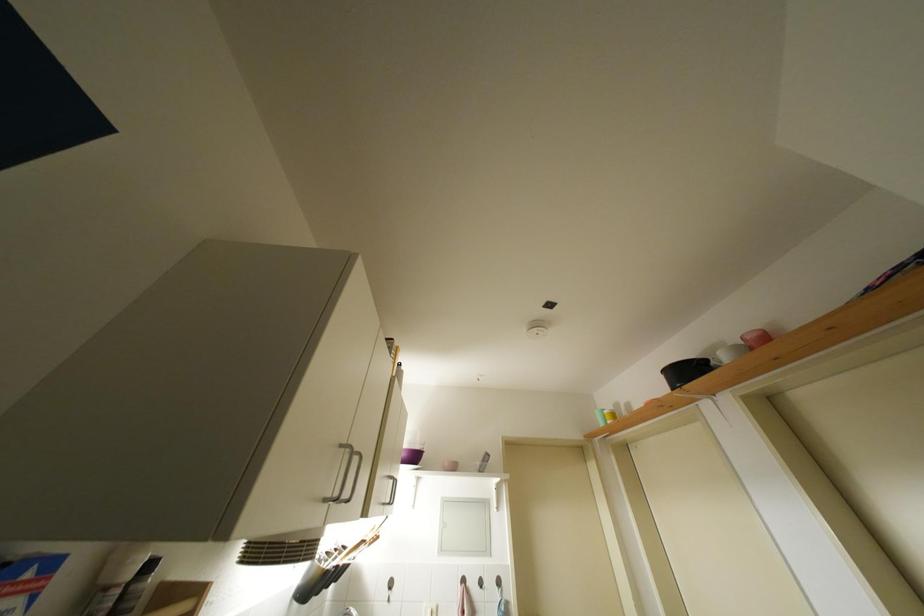
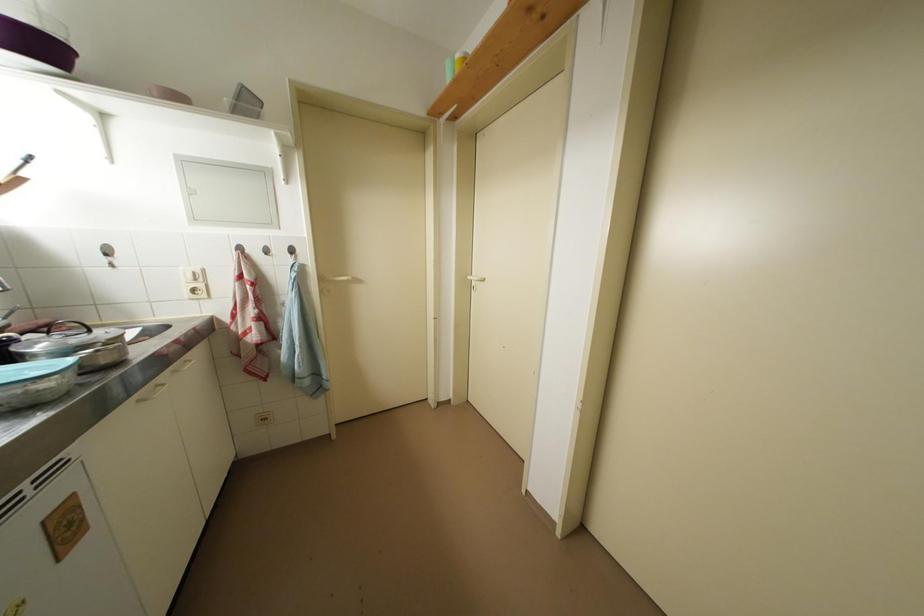
The images are taken continuously from a first-person perspective. In which direction is your viewpoint rotating?

The rotation direction of the camera is right-down.